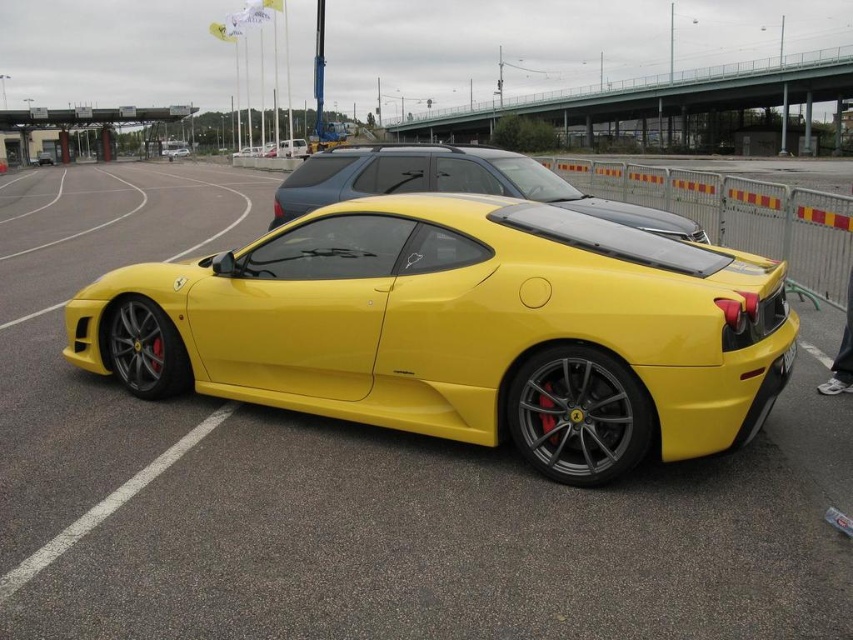
Is matte yellow sports car at center positioned at the back of yellow matte/satin car at center?

No, it is not.

Which is behind, point (180, 323) or point (294, 186)?

Point (294, 186)

The image size is (853, 640). What are the coordinates of `matte yellow sports car at center` in the screenshot? It's located at (462, 330).

Who is taller, yellow matte/satin car at center or matte white van at center?

matte white van at center

At what (x,y) coordinates should I click in order to perform the action: click on yellow matte/satin car at center. Please return your answer as a coordinate pair (x, y). Looking at the image, I should click on (451, 182).

Does matte yellow sports car at center have a greater height compared to yellow matte license plate at center?

Correct, matte yellow sports car at center is much taller as yellow matte license plate at center.

Can you confirm if matte yellow sports car at center is positioned above yellow matte license plate at center?

Yes, matte yellow sports car at center is above yellow matte license plate at center.

Find the location of `matte yellow sports car at center`. matte yellow sports car at center is located at coordinates tap(462, 330).